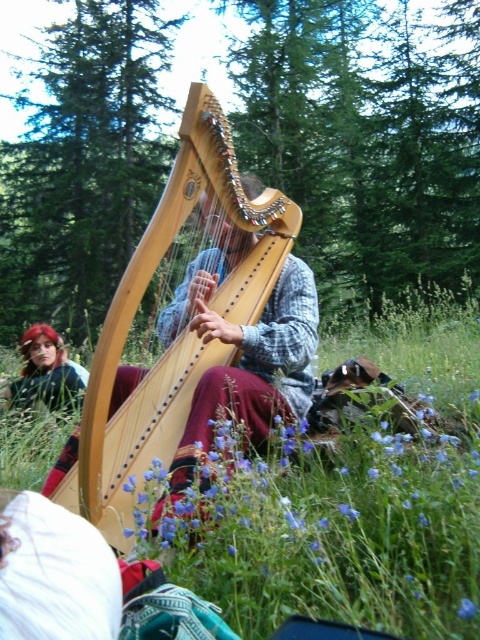
You are a photographer trying to capture the harp player in the scene. You notice the green grass at center and the blue matte flower at center. Which object should you focus on if you want to highlight something larger in the foreground?

The green grass at center has a larger size compared to the blue matte flower at center, so focusing on the green grass at center would better highlight a larger object in the foreground.

Looking at this image, you are a photographer trying to capture the harp player in the scene. You notice the green grass at center and the shiny red hair at lower left. Which object is wider in the image?

The green grass at center is wider than the shiny red hair at lower left.